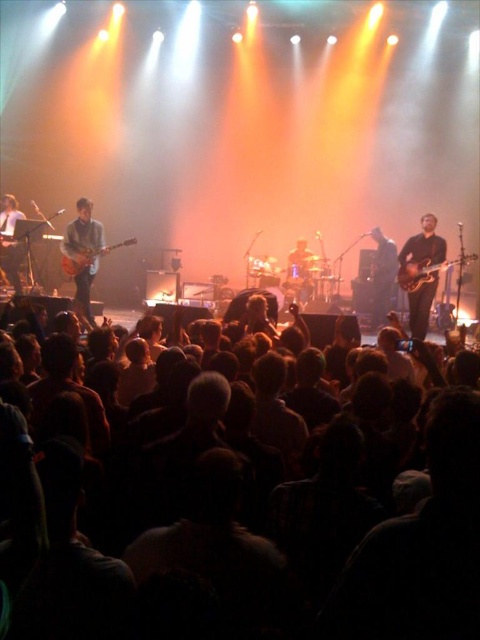
You are a photographer at the concert. You want to take a photo of the shiny brown guitar at right without including the dark matte crowd at lower center in the frame. Is this possible based on their positions?

The dark matte crowd at lower center is positioned on the left side of the shiny brown guitar at right. Therefore, if you position yourself to the right of the guitar, you can capture the guitar without the crowd in the frame.

You are a stagehand who needs to place a protective cover over both the shiny brown guitar at right and the shiny black guitar at center. Which guitar requires a larger cover based on their sizes?

The shiny brown guitar at right requires a larger cover because its width is greater than that of the shiny black guitar at center.

You are a photographer at the concert and want to capture a closeup of the shiny brown guitar at right. The stage is very bright, so you need to adjust your camera settings. Since the guitar is at point [421,269], which is closer to the center of the stage, you should use a lower ISO to reduce noise. Is this correct?

Yes, since the point [421,269] is closer to the center of the stage, the area is likely well lit. Using a lower ISO will reduce noise while maintaining image quality.